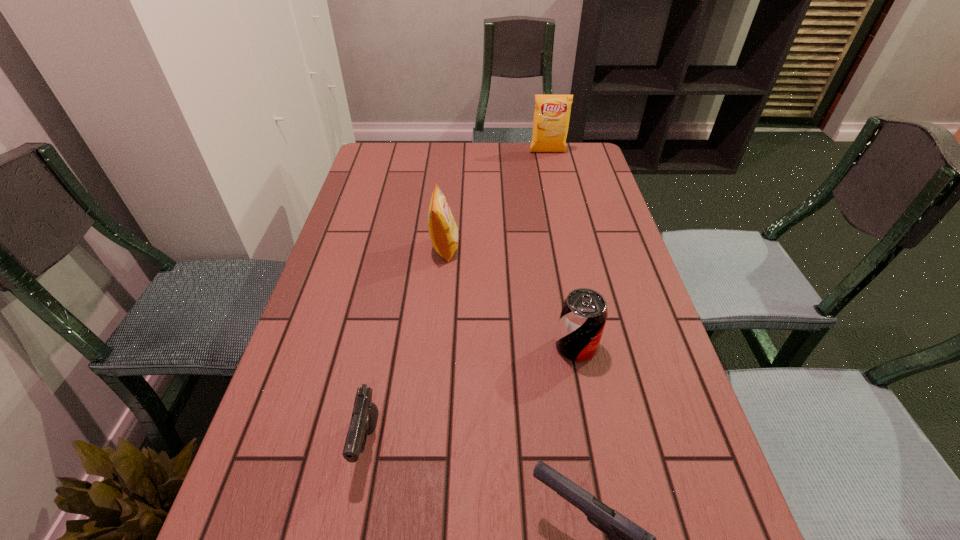
Image resolution: width=960 pixels, height=540 pixels. What are the coordinates of `free space located at the barrel of the leftmost object` in the screenshot? It's located at (352, 525).

This screenshot has height=540, width=960. In order to click on object present at the far edge in this screenshot , I will do `click(552, 112)`.

Image resolution: width=960 pixels, height=540 pixels. Identify the location of crisp (potato chip) that is at the right edge. (552, 112).

The height and width of the screenshot is (540, 960). I want to click on soda can present at the right edge, so click(584, 312).

Find the location of `object present at the far right corner`. object present at the far right corner is located at coordinates (552, 112).

In the image, there is a desktop. At what (x,y) coordinates should I click in order to perform the action: click on vacant space at the far edge. Please return your answer as a coordinate pair (x, y). Looking at the image, I should click on (501, 171).

Locate an element on the screen. The width and height of the screenshot is (960, 540). free region at the left edge is located at coordinates (364, 214).

Locate an element on the screen. Image resolution: width=960 pixels, height=540 pixels. vacant space at the right edge of the desktop is located at coordinates (595, 208).

Locate an element on the screen. The height and width of the screenshot is (540, 960). vacant region between the third nearest object and the shortest object is located at coordinates (472, 394).

Where is `free point between the fourth farthest object and the taller crisp (potato chip)`? free point between the fourth farthest object and the taller crisp (potato chip) is located at coordinates (458, 297).